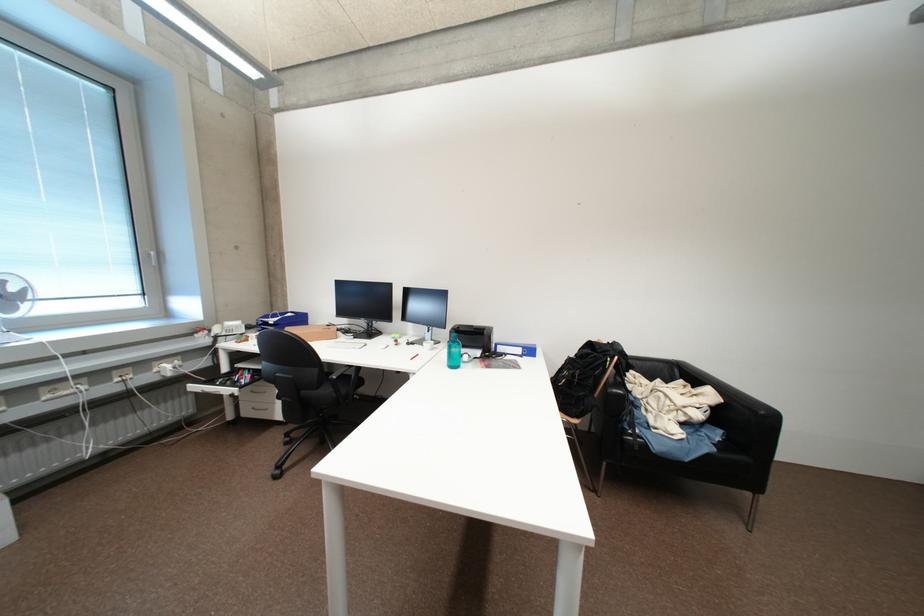
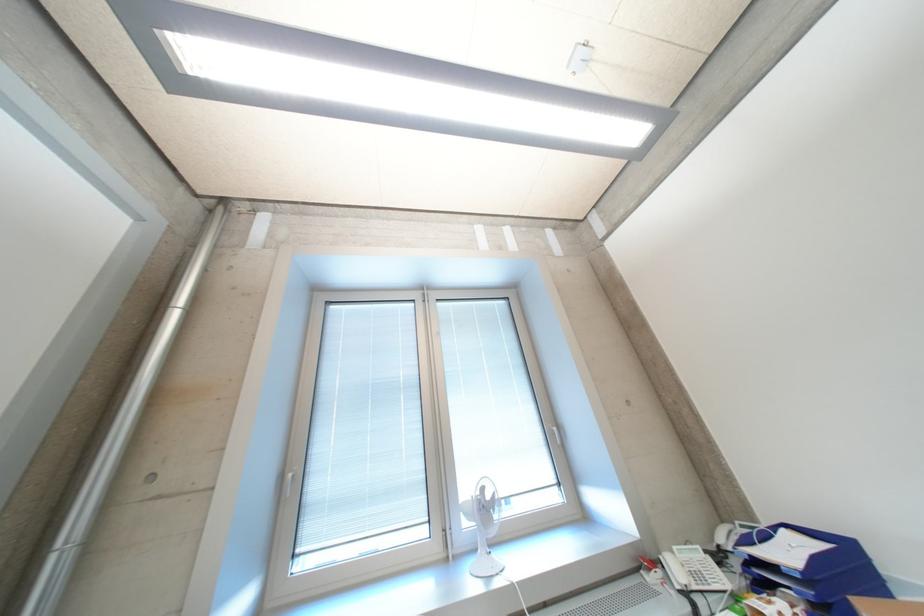
Find the pixel in the second image that matches point (274, 318) in the first image.

(757, 543)